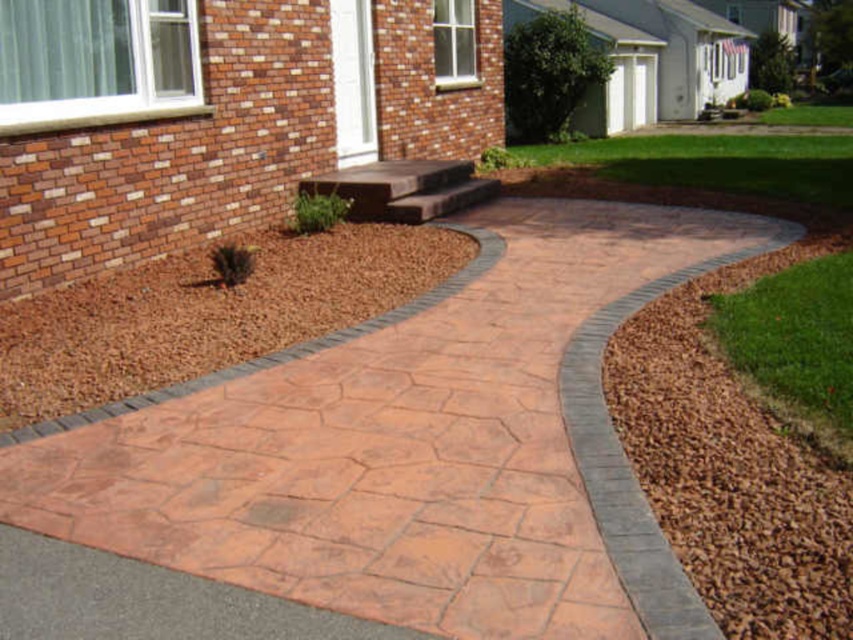
Does terracotta concrete path at center appear on the right side of brown gravel at lower right?

No, terracotta concrete path at center is not to the right of brown gravel at lower right.

Does point (486, 468) come in front of point (762, 275)?

That is True.

This screenshot has height=640, width=853. What are the coordinates of `terracotta concrete path at center` in the screenshot? It's located at (380, 465).

Image resolution: width=853 pixels, height=640 pixels. Describe the element at coordinates (380, 465) in the screenshot. I see `terracotta concrete path at center` at that location.

Is point (483, 452) positioned in front of point (84, 424)?

Yes, point (483, 452) is closer to viewer.

Image resolution: width=853 pixels, height=640 pixels. What are the coordinates of `terracotta concrete path at center` in the screenshot? It's located at (380, 465).

Between point (727, 538) and point (233, 369), which one is positioned in front?

Point (727, 538) is in front.

Which is more to the left, brown gravel at lower right or brown mulch at lower left?

brown mulch at lower left

What do you see at coordinates (733, 465) in the screenshot? I see `brown gravel at lower right` at bounding box center [733, 465].

Image resolution: width=853 pixels, height=640 pixels. I want to click on brown gravel at lower right, so click(733, 465).